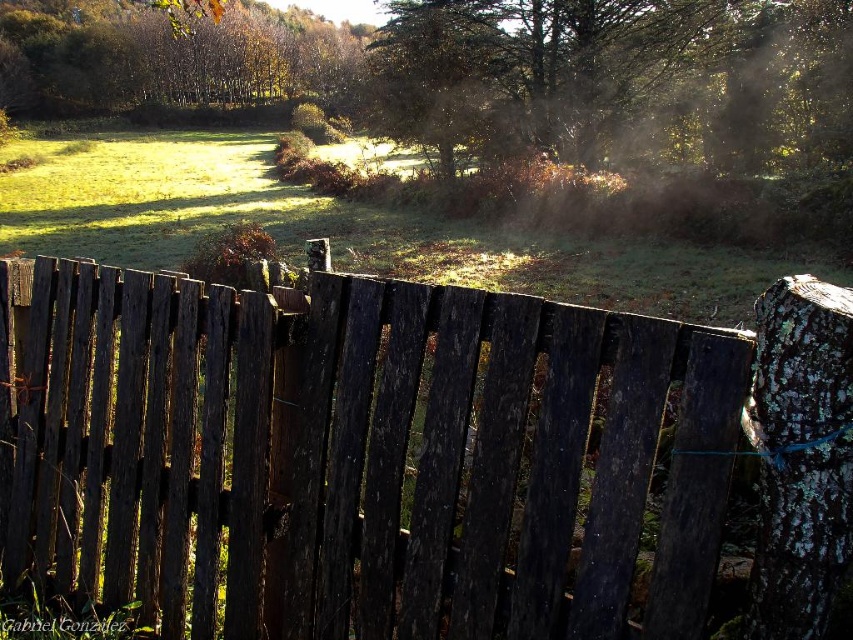
You are a painter setting up an easel to capture the rural scene. You want to ensure the weathered wood fence at center and the green leafy tree at upper left are both visible in your painting. Based on their widths, which object should you place closer to the center of your canvas to maintain balance?

The weathered wood fence at center has a lesser width compared to green leafy tree at upper left, so to maintain balance in the painting, you should place the weathered wood fence at center closer to the center of the canvas since it is narrower and needs to be emphasized.

Looking at this image, you are standing in the middle of the field and see the weathered wood fence at center and the green leafy tree at upper left. Which object is positioned to the right when facing the scene?

The weathered wood fence at center is positioned to the right of the green leafy tree at upper left.

You are standing at the edge of the grassy field and see the point marked at coordinates (357, 454). Based on the scene description, what object is located at that point?

The point at coordinates (357, 454) corresponds to the weathered wood fence at center.